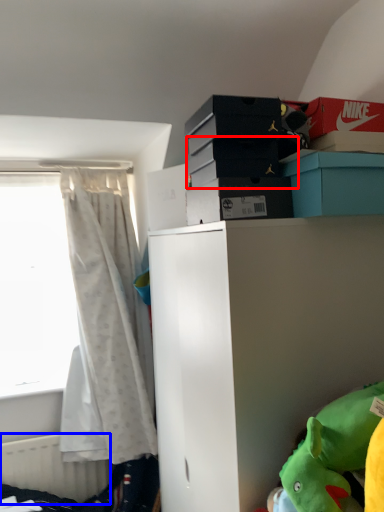
Question: Among these objects, which one is farthest to the camera, storage box (highlighted by a red box) or radiator (highlighted by a blue box)?

Choices:
 (A) storage box
 (B) radiator

Answer: (B)